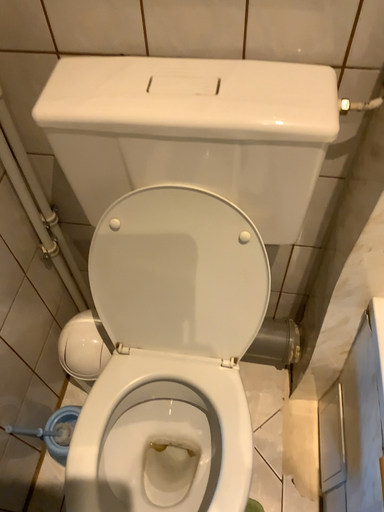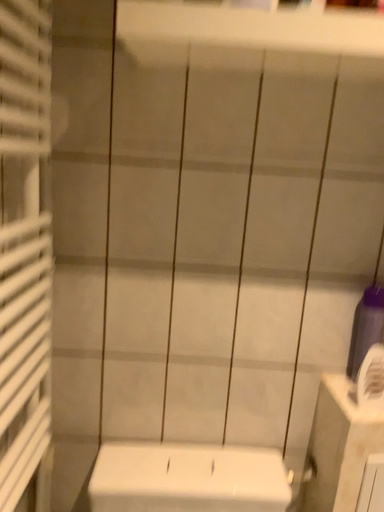
Question: Which way did the camera rotate in the video?

Choices:
 (A) rotated downward
 (B) rotated upward

Answer: (B)